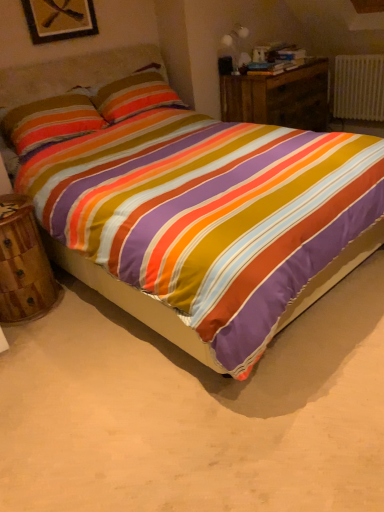
Question: Considering the positions of textured cotton pillow at upper left and wooden nightstand at center, which is the first nightstand from right to left, in the image, is textured cotton pillow at upper left wider or thinner than wooden nightstand at center, which is the first nightstand from right to left,?

Choices:
 (A) thin
 (B) wide

Answer: (A)

Question: Is textured cotton pillow at upper left taller or shorter than wooden nightstand at center, the second nightstand when ordered from left to right?

Choices:
 (A) tall
 (B) short

Answer: (B)

Question: Which is farther from the wooden nightstand at center, which is the second nightstand from bottom to top?

Choices:
 (A) wooden nightstand at lower left, which is the 1th nightstand from front to back
 (B) matte white table lamp at upper right
 (C) white plastic radiator at upper right
 (D) textured cotton pillow at upper left
 (E) wooden picture frame at upper left

Answer: (A)

Question: Estimate the real-world distances between objects in this image. Which object is closer to the wooden nightstand at center, which is the second nightstand from bottom to top?

Choices:
 (A) matte white table lamp at upper right
 (B) textured cotton pillow at upper left
 (C) white plastic radiator at upper right
 (D) wooden picture frame at upper left
 (E) wooden nightstand at lower left, the second nightstand from the right

Answer: (A)